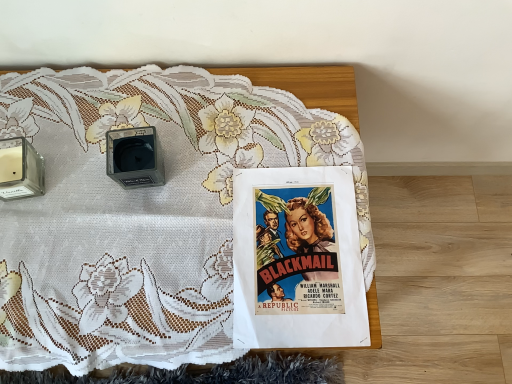
This screenshot has width=512, height=384. In order to click on vacant area that lies between matte black speaker at center, positioned as the 2th speaker in left-to-right order, and matte paper poster at center in this screenshot , I will do `click(200, 216)`.